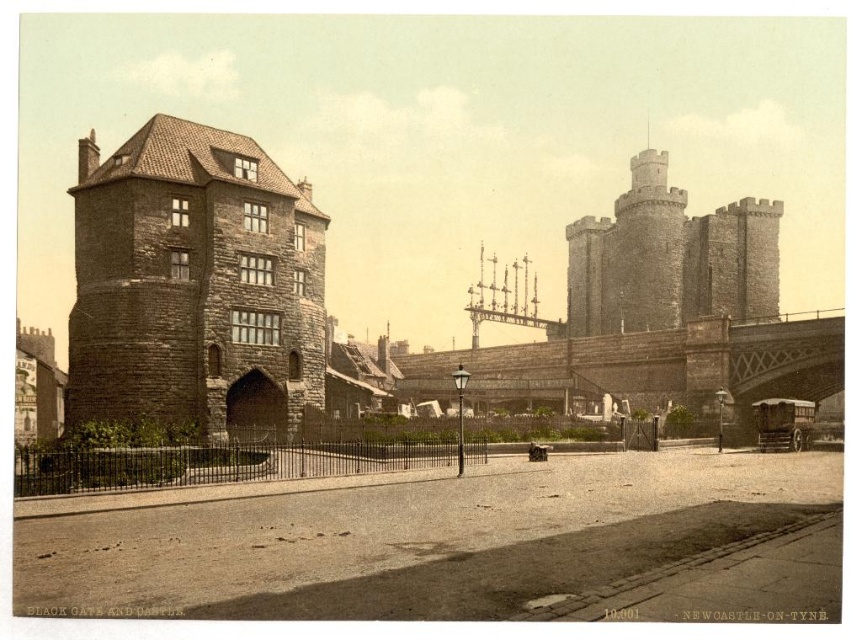
Question: Among these objects, which one is farthest from the camera?

Choices:
 (A) brown stone tower at left
 (B) brown stone bridge at center

Answer: (B)

Question: Is brown stone tower at left wider than brown stone bridge at center?

Choices:
 (A) no
 (B) yes

Answer: (A)

Question: Does brown stone tower at left appear on the right side of brown stone bridge at center?

Choices:
 (A) yes
 (B) no

Answer: (B)

Question: Does brown stone tower at left have a larger size compared to brown stone bridge at center?

Choices:
 (A) yes
 (B) no

Answer: (B)